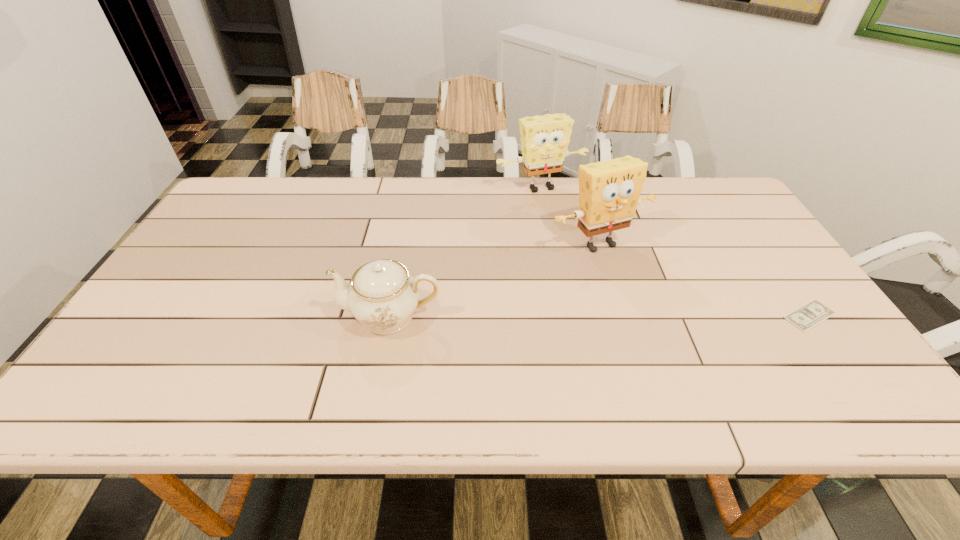
You are a GUI agent. You are given a task and a screenshot of the screen. Output one action in this format:
    pyautogui.click(x=<x>, y=<y>)
    Task: Click on the vacant area at the near edge of the desktop
    The height and width of the screenshot is (540, 960).
    Given the screenshot: What is the action you would take?
    pyautogui.click(x=419, y=370)

I want to click on free location at the left edge, so click(x=205, y=247).

The image size is (960, 540). In the image, there is a desktop. In order to click on vacant area at the far left corner in this screenshot , I will do `click(269, 198)`.

In the image, there is a desktop. Identify the location of vacant space at the near left corner. This screenshot has height=540, width=960. (x=151, y=368).

This screenshot has width=960, height=540. Find the location of `free space between the farthest object and the money`. free space between the farthest object and the money is located at coordinates (x=675, y=251).

I want to click on empty location between the rightmost object and the third tallest object, so click(x=600, y=315).

You are a GUI agent. You are given a task and a screenshot of the screen. Output one action in this format:
    pyautogui.click(x=<x>, y=<y>)
    Task: Click on the free spot between the leftmost object and the farthest object
    The image size is (960, 540).
    Given the screenshot: What is the action you would take?
    pyautogui.click(x=466, y=251)

The height and width of the screenshot is (540, 960). I want to click on vacant area between the farther sponge and the third tallest object, so click(466, 251).

Where is `free space between the farther sponge and the leftmost object`? The height and width of the screenshot is (540, 960). free space between the farther sponge and the leftmost object is located at coordinates (466, 251).

Identify the location of free space that is in between the leftmost object and the shortest object. (600, 315).